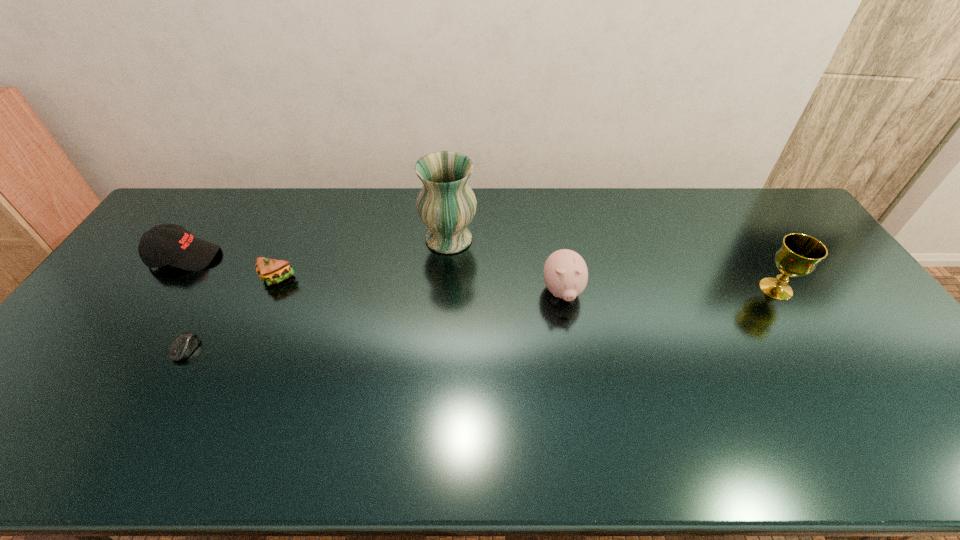
Locate an element on the screen. This screenshot has width=960, height=540. the shortest object is located at coordinates (184, 345).

The width and height of the screenshot is (960, 540). I want to click on vacant area situated 0.200m on the back of the third object from right to left, so click(453, 188).

I want to click on vacant region located on the back of the fifth shortest object, so click(x=759, y=262).

The width and height of the screenshot is (960, 540). In order to click on free region located 0.190m at the snout of the piggy bank in this screenshot , I will do `click(577, 372)`.

You are a GUI agent. You are given a task and a screenshot of the screen. Output one action in this format:
    pyautogui.click(x=<x>, y=<y>)
    Task: Click on the free location located 0.150m on the front-facing side of the leftmost object
    This screenshot has height=540, width=960.
    Given the screenshot: What is the action you would take?
    pyautogui.click(x=267, y=257)

The width and height of the screenshot is (960, 540). What are the coordinates of `vacant space located 0.180m on the front of the second shortest object` in the screenshot? It's located at (251, 338).

You are a GUI agent. You are given a task and a screenshot of the screen. Output one action in this format:
    pyautogui.click(x=<x>, y=<y>)
    Task: Click on the blank area located on the right of the mouse
    The image size is (960, 540).
    Given the screenshot: What is the action you would take?
    pyautogui.click(x=266, y=349)

At what (x,y) coordinates should I click in order to perform the action: click on object located at the far edge. Please return your answer as a coordinate pair (x, y). Looking at the image, I should click on (446, 204).

This screenshot has width=960, height=540. In order to click on object present at the left edge in this screenshot , I will do `click(167, 244)`.

This screenshot has width=960, height=540. In the image, there is a desktop. Find the location of `vacant space at the far edge`. vacant space at the far edge is located at coordinates (617, 200).